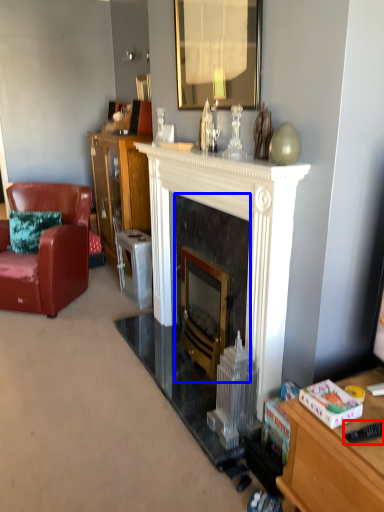
Question: Among these objects, which one is farthest to the camera, remote control (highlighted by a red box) or fireplace (highlighted by a blue box)?

Choices:
 (A) remote control
 (B) fireplace

Answer: (B)